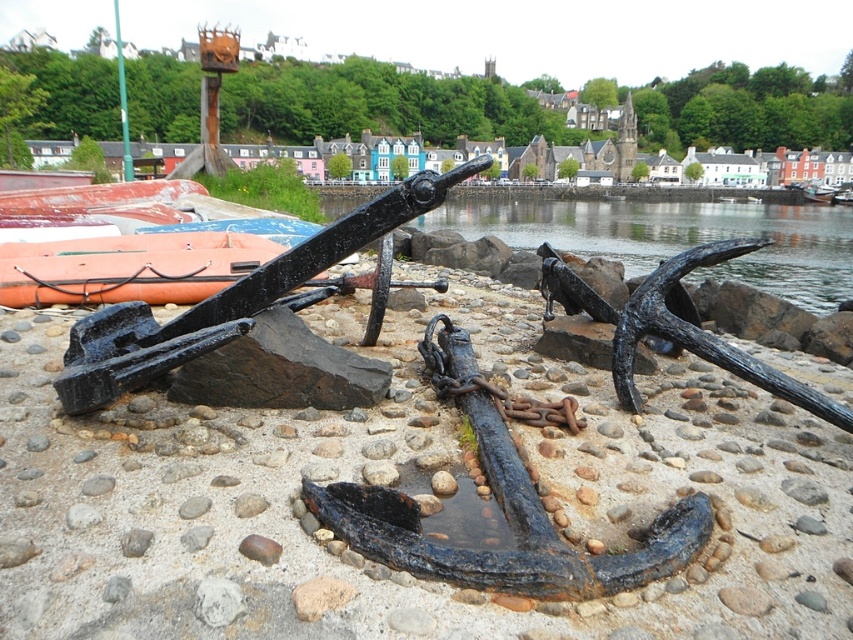
Question: Which object appears closest to the camera in this image?

Choices:
 (A) clear water at center
 (B) orange rubber boat at left
 (C) rusty metal anchor at center

Answer: (C)

Question: Is rusty metal anchor at center further to camera compared to clear water at center?

Choices:
 (A) yes
 (B) no

Answer: (B)

Question: Does rusty metal anchor at center appear on the left side of orange rubber boat at left?

Choices:
 (A) yes
 (B) no

Answer: (B)

Question: In this image, where is rusty metal anchor at center located relative to clear water at center?

Choices:
 (A) below
 (B) above

Answer: (A)

Question: Which object is positioned closest to the clear water at center?

Choices:
 (A) rusty metal anchor at center
 (B) orange rubber boat at left

Answer: (A)

Question: Which object appears closest to the camera in this image?

Choices:
 (A) clear water at center
 (B) orange rubber boat at left

Answer: (A)